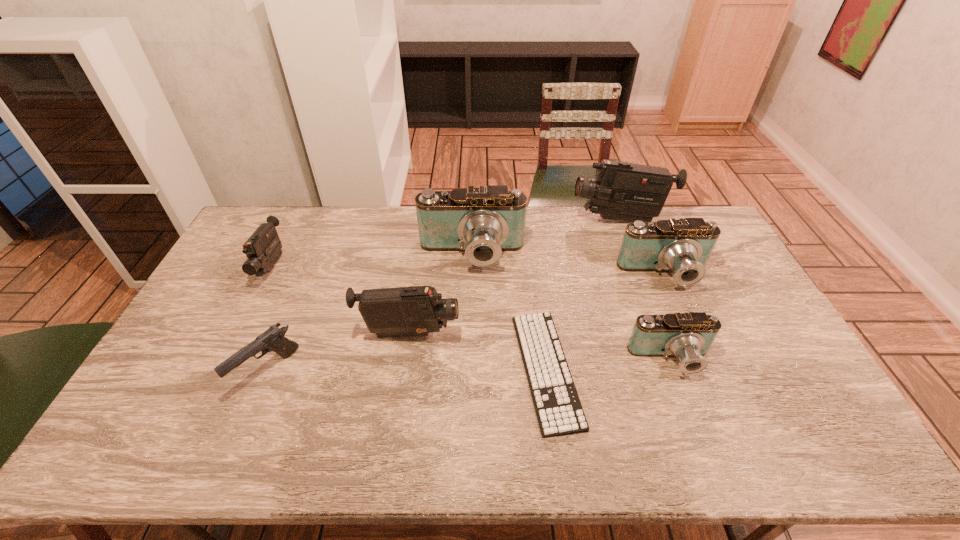
At what (x,y) coordinates should I click in order to perform the action: click on the farthest black camcorder. Please return your answer as a coordinate pair (x, y). The height and width of the screenshot is (540, 960). Looking at the image, I should click on (624, 191).

Locate an element on the screen. the farthest object is located at coordinates (624, 191).

Identify the location of the leftmost blue camcorder. (483, 222).

Where is `the nearest black camcorder`? The image size is (960, 540). the nearest black camcorder is located at coordinates (403, 311).

Locate an element on the screen. the second black camcorder from right to left is located at coordinates tap(403, 311).

Where is `the second biggest blue camcorder`? This screenshot has height=540, width=960. the second biggest blue camcorder is located at coordinates (683, 246).

The image size is (960, 540). Identify the location of the smallest black camcorder. (263, 248).

I want to click on the leftmost camcorder, so click(x=263, y=248).

The height and width of the screenshot is (540, 960). I want to click on the nearest blue camcorder, so click(x=688, y=336).

The image size is (960, 540). I want to click on gun, so click(x=273, y=339).